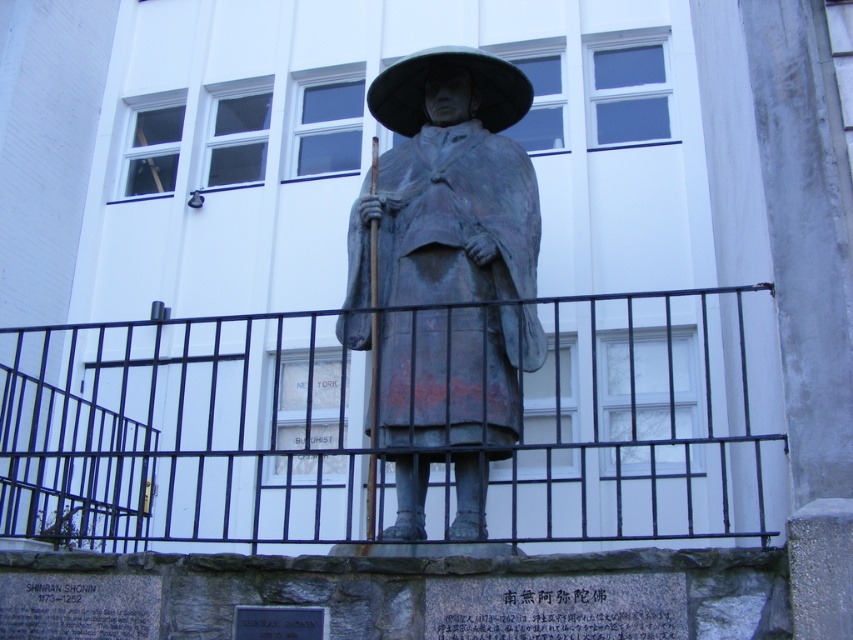
You are standing in front of the statue and want to touch the black metal fence at center. Based on the coordinates given, can you reach the point at (183, 432)?

The point at (183, 432) corresponds to the black metal fence at center, so yes, you can reach that point by touching the black metal fence at center.

You are standing in front of the statue and want to get a closer look. The black metal fence at center and bronze statue at center are in your way. Which object is blocking your path more to your left?

The black metal fence at center is to the left of bronze statue at center, so it is blocking your path more to the left.

You are standing in front of the statue and want to take a photo of the statue without the black metal fence at center appearing in the frame. Where should you position yourself relative to the statue?

To avoid the black metal fence at center in the photo, you should position yourself directly in front of the statue, as the fence is located at the base of the statue. Since the fence is at point (183, 432), which is near the center bottom, moving to a position slightly above or behind the statue might help frame it without the fence. However, since the fence is at the base, standing directly in front and adjusting the camera angle upwards could exclude the fence from the frame.